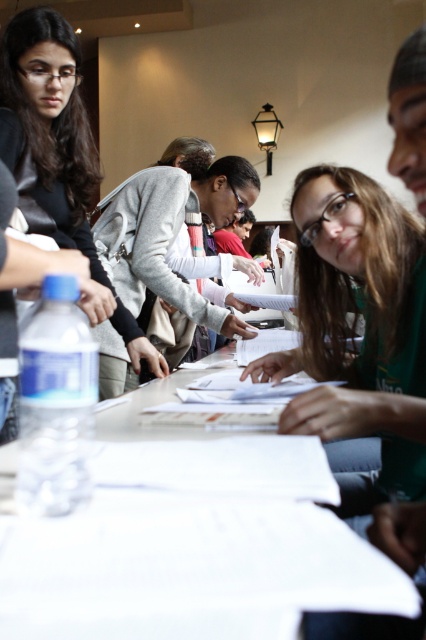
The width and height of the screenshot is (426, 640). In order to click on matte black jacket at upper left in this screenshot , I will do `click(55, 148)`.

Who is shorter, matte black jacket at upper left or light gray sweater at center?

matte black jacket at upper left is shorter.

The image size is (426, 640). What do you see at coordinates (55, 148) in the screenshot?
I see `matte black jacket at upper left` at bounding box center [55, 148].

Find the location of a particular element. Image resolution: width=426 pixels, height=640 pixels. matte black jacket at upper left is located at coordinates (55, 148).

Is white paper at center below light gray sweater at center?

Indeed, white paper at center is positioned under light gray sweater at center.

Is point (290, 560) closer to camera compared to point (213, 152)?

That is True.

Locate an element on the screen. Image resolution: width=426 pixels, height=640 pixels. white paper at center is located at coordinates (190, 564).

Can you confirm if white paper at center is smaller than matte black jacket at upper left?

Indeed, white paper at center has a smaller size compared to matte black jacket at upper left.

Does white paper at center have a greater width compared to matte black jacket at upper left?

No, white paper at center is not wider than matte black jacket at upper left.

Is point (14, 588) positioned in front of point (46, 80)?

Yes, point (14, 588) is in front of point (46, 80).

Where is `white paper at center`? The height and width of the screenshot is (640, 426). white paper at center is located at coordinates (190, 564).